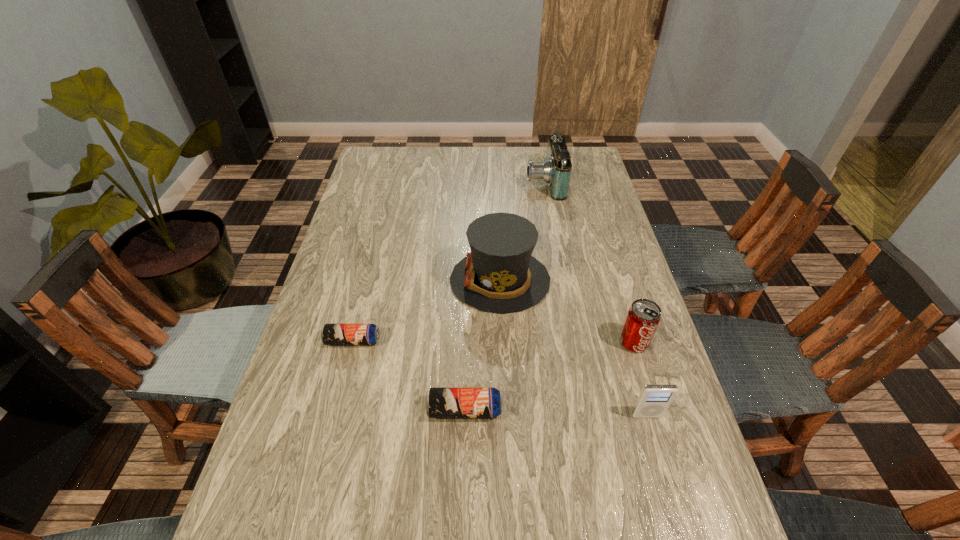
Identify which object is the closest to the right beer can. Please provide its 2D coordinates. Your answer should be formatted as a tuple, i.e. [(x, y)], where the tuple contains the x and y coordinates of a point satisfying the conditions above.

[(331, 334)]

Locate an element on the screen. The width and height of the screenshot is (960, 540). vacant region that satisfies the following two spatial constraints: 1. on the front-facing side of the camcorder; 2. on the back side of the pop soda is located at coordinates (574, 342).

Locate an element on the screen. The height and width of the screenshot is (540, 960). vacant space that satisfies the following two spatial constraints: 1. with goggles on the front of the pop soda; 2. on the left side of the dress hat is located at coordinates (503, 342).

Find the location of `blank area in the image that satisfies the following two spatial constraints: 1. on the front-facing side of the pop soda; 2. on the left side of the farthest object`. blank area in the image that satisfies the following two spatial constraints: 1. on the front-facing side of the pop soda; 2. on the left side of the farthest object is located at coordinates (574, 342).

This screenshot has width=960, height=540. In order to click on free spot that satisfies the following two spatial constraints: 1. on the front-facing side of the farthest object; 2. on the front side of the farther beer can in this screenshot , I will do `click(574, 341)`.